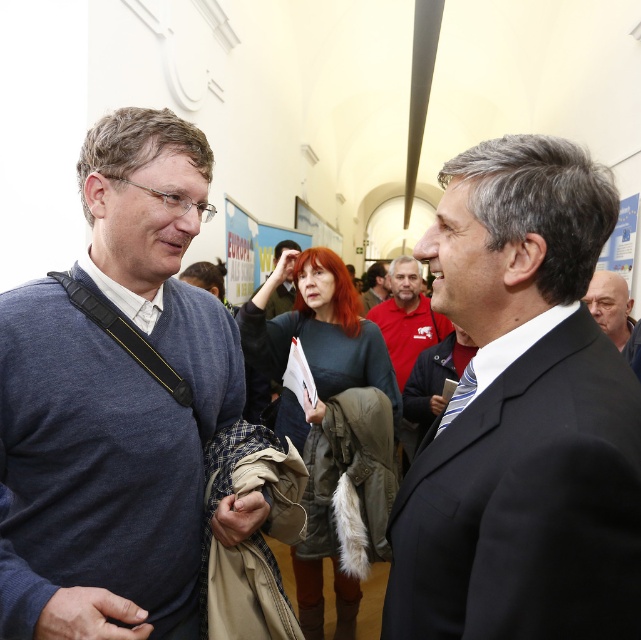
You are a photographer at the event and need to adjust your camera to focus on the black suit at center. If your camera has a minimum focusing distance of 34 inches, will you need to move closer or farther away?

The black suit at center and camera are 34.21 inches apart. Since the minimum focusing distance is 34 inches, you need to move slightly closer to ensure the camera can focus properly.

You are at a gallery event and notice two people in the crowd. There is a bald head at right and a red shirt at center. Which one is positioned more to the east side of the room?

The bald head at right is positioned to the right of the red shirt at center, so it is more to the east side of the room.

You are attending an exhibition and notice a bald head at right. Can you determine its exact coordinates in the image?

The bald head at right is located at point (610, 305).